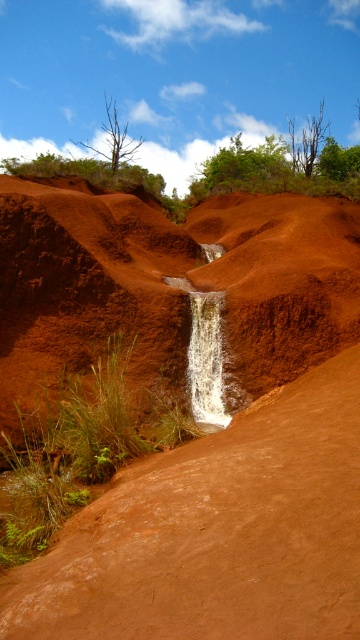
You are planning to plant a new tree between the green leafy tree at upper center and the bare wood tree at upper center. The new tree requires a minimum of 5 meters of space between it and any existing trees. Based on the current spacing between the two trees, is this possible?

The green leafy tree at upper center and the bare wood tree at upper center are 4.31 meters apart from each other. Since the required minimum space is 5 meters, the new tree cannot be planted between them as the existing distance is less than the required spacing.

You are an environmental scientist studying the landscape. You observe the green leafy tree at upper center and the bare wood tree at upper center. Which tree would you expect to have a smaller canopy spread based on their sizes?

The green leafy tree at upper center has a smaller size compared to the bare wood tree at upper center, so its canopy spread would also be smaller.

You are standing at the base of the waterfall in the center of the volcanic landscape. You notice two points marked in the scene. Which point is closer to you, point (127, 125) or point (306, 124)?

Point (127, 125) is closer to you because it is further to the viewer than point (306, 124).